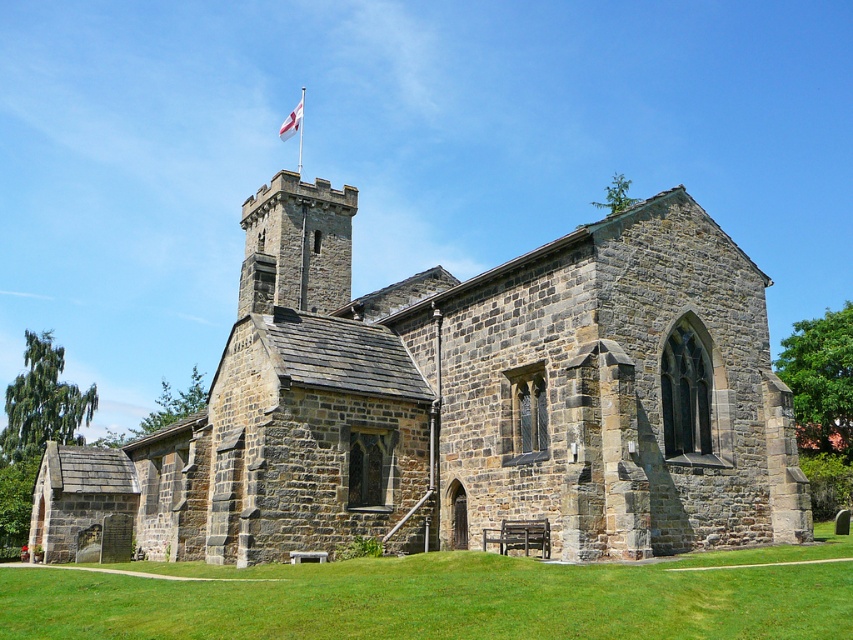
You are standing in front of the historic stone church and notice the white fabric flag at upper center and the metallic flag pole at upper center. Which object is wider?

The white fabric flag at upper center is wider than the metallic flag pole at upper center.

You are standing at the entrance of the historic stone church and looking towards the tower on the left. There is a point marked at coordinates point (445, 596). What is located at this point?

The green grass at lower center is located at point (445, 596).

You are standing at the base of the metallic flag pole at upper center in the historic stone church scene. You want to walk directly towards the green grass at lower center. Given that the distance between them is 726.47 feet, will you have to walk more than a football field length to reach the grass?

The distance between the metallic flag pole at upper center and the green grass at lower center is 726.47 feet. Since a standard football field is 360 feet long, you would need to walk more than double that distance, so yes, you would have to walk more than a football field length to reach the grass.